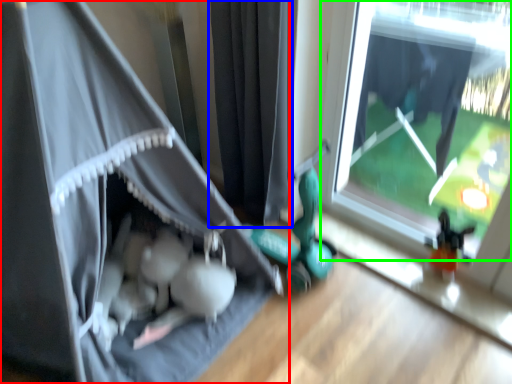
Question: Based on their relative distances, which object is nearer to curtain (highlighted by a red box)? Choose from curtain (highlighted by a blue box) and window (highlighted by a green box).

Choices:
 (A) curtain
 (B) window

Answer: (A)